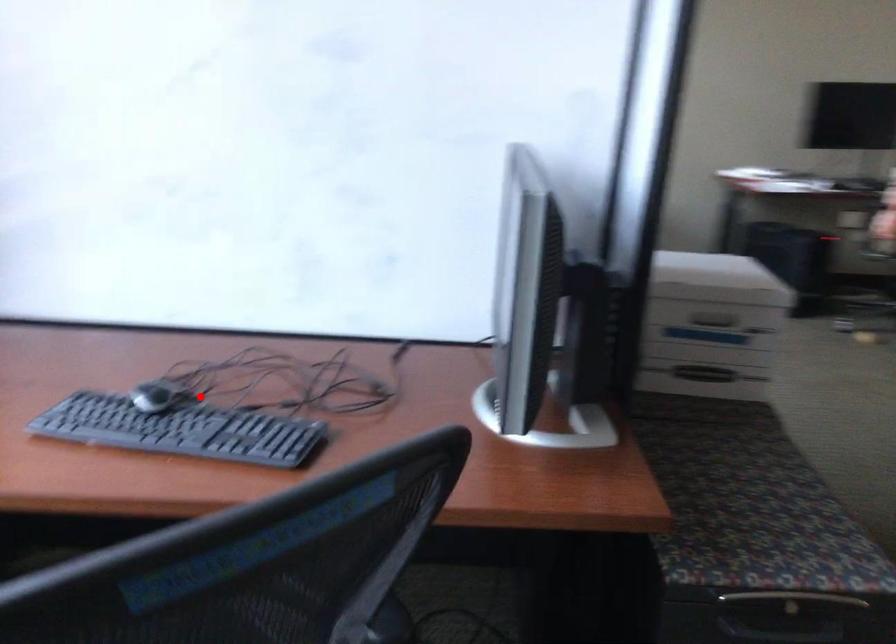
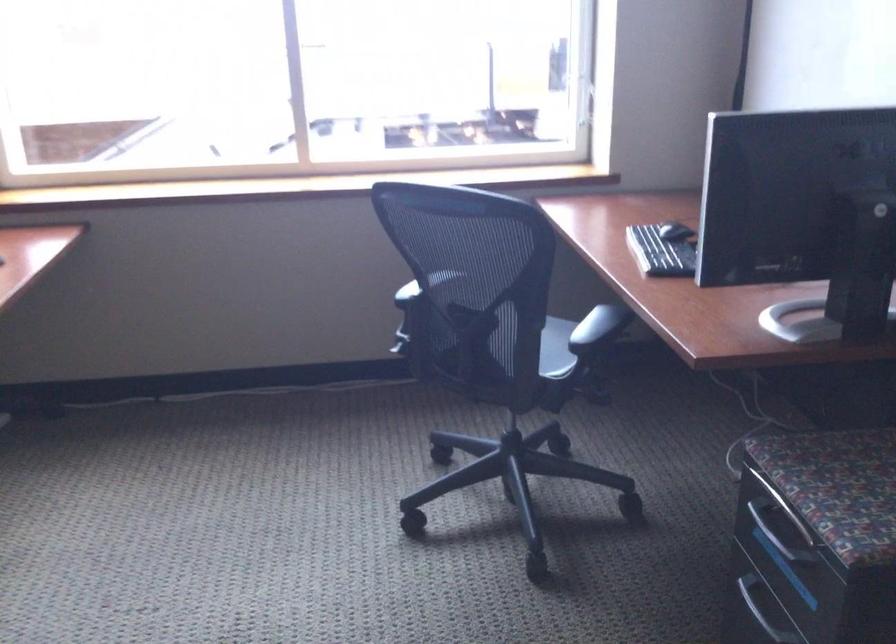
Locate, in the second image, the point that corresponds to the highlighted location in the first image.

(676, 231)